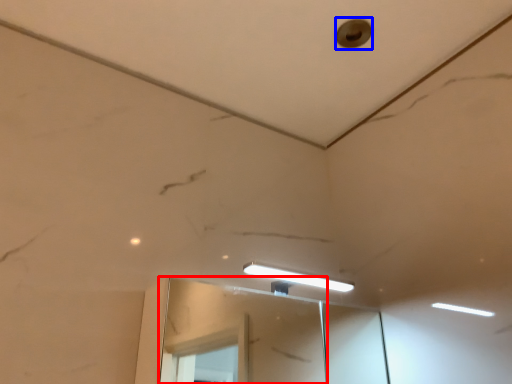
Question: Which object is further to the camera taking this photo, mirror (highlighted by a red box) or hole (highlighted by a blue box)?

Choices:
 (A) mirror
 (B) hole

Answer: (B)